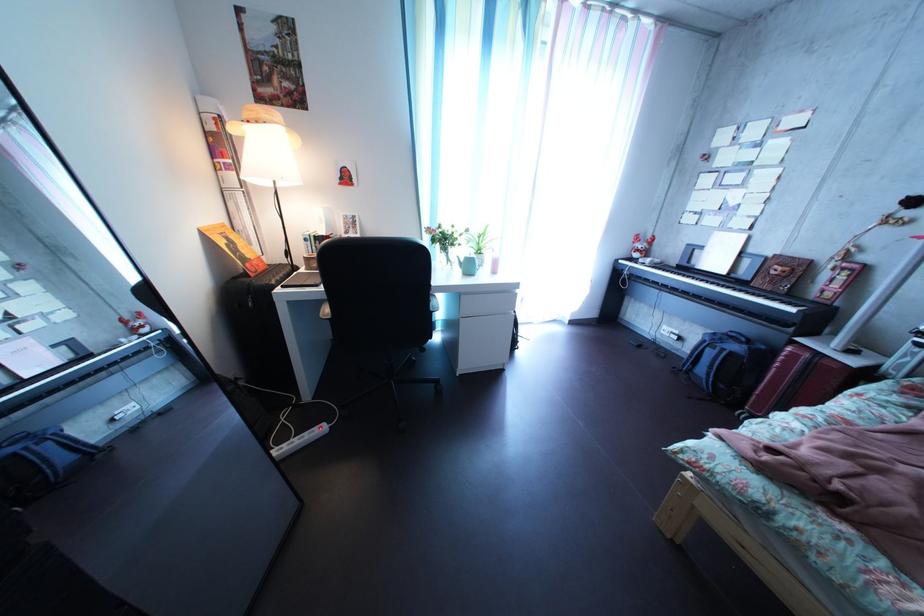
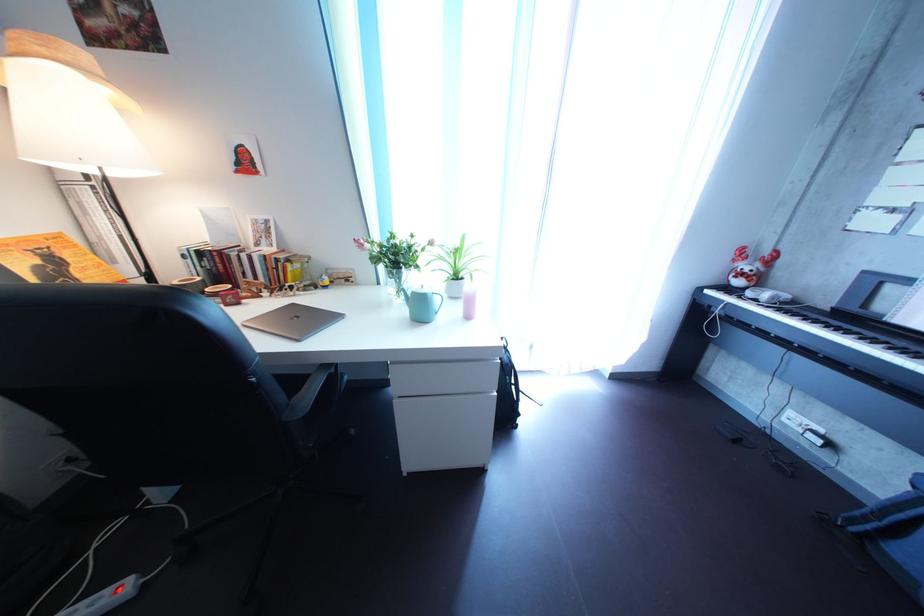
In the second image, find the point that corresponds to (672,269) in the first image.

(801, 304)